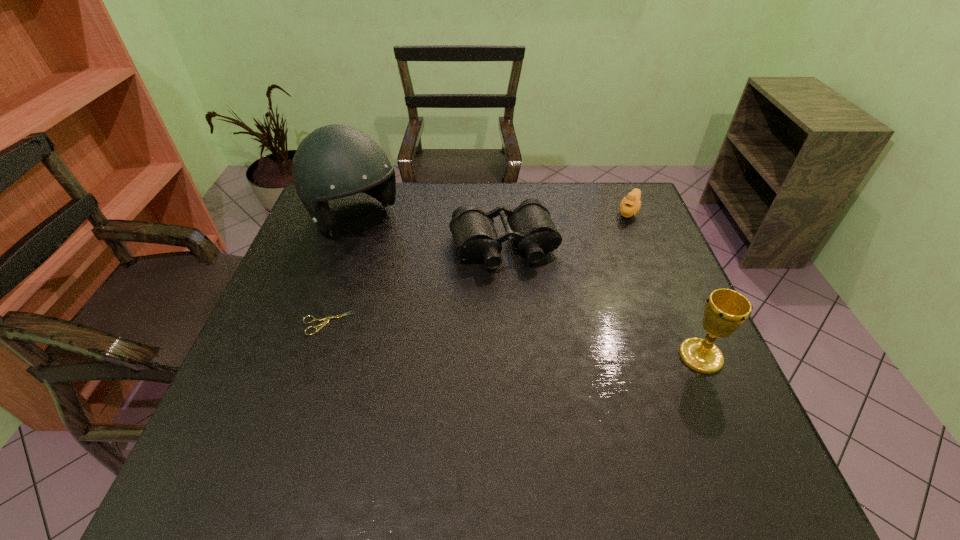
At what (x,y) coordinates should I click in order to perform the action: click on duckling positioned at the far edge. Please return your answer as a coordinate pair (x, y). Looking at the image, I should click on (630, 205).

Identify the location of shears at the left edge. The image size is (960, 540). (326, 320).

At what (x,y) coordinates should I click in order to perform the action: click on football helmet located in the left edge section of the desktop. Please return your answer as a coordinate pair (x, y). The height and width of the screenshot is (540, 960). Looking at the image, I should click on (334, 161).

The height and width of the screenshot is (540, 960). What are the coordinates of `chalice present at the right edge` in the screenshot? It's located at (726, 310).

Where is `duckling positioned at the right edge`? The image size is (960, 540). duckling positioned at the right edge is located at coordinates (630, 205).

This screenshot has width=960, height=540. What are the coordinates of `object situated at the far left corner` in the screenshot? It's located at (334, 161).

Locate an element on the screen. The image size is (960, 540). object situated at the far right corner is located at coordinates (630, 205).

Where is `vacant space at the far edge of the desktop`? vacant space at the far edge of the desktop is located at coordinates (431, 217).

In the image, there is a desktop. At what (x,y) coordinates should I click in order to perform the action: click on vacant space at the left edge. Please return your answer as a coordinate pair (x, y). Image resolution: width=960 pixels, height=540 pixels. Looking at the image, I should click on (322, 267).

Identify the location of free region at the right edge of the desktop. The width and height of the screenshot is (960, 540). point(647,268).